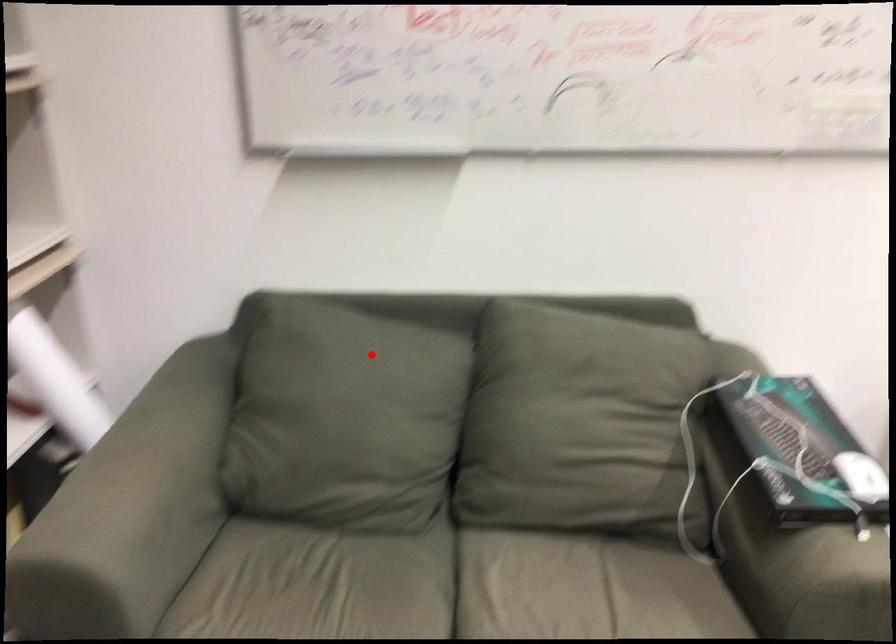
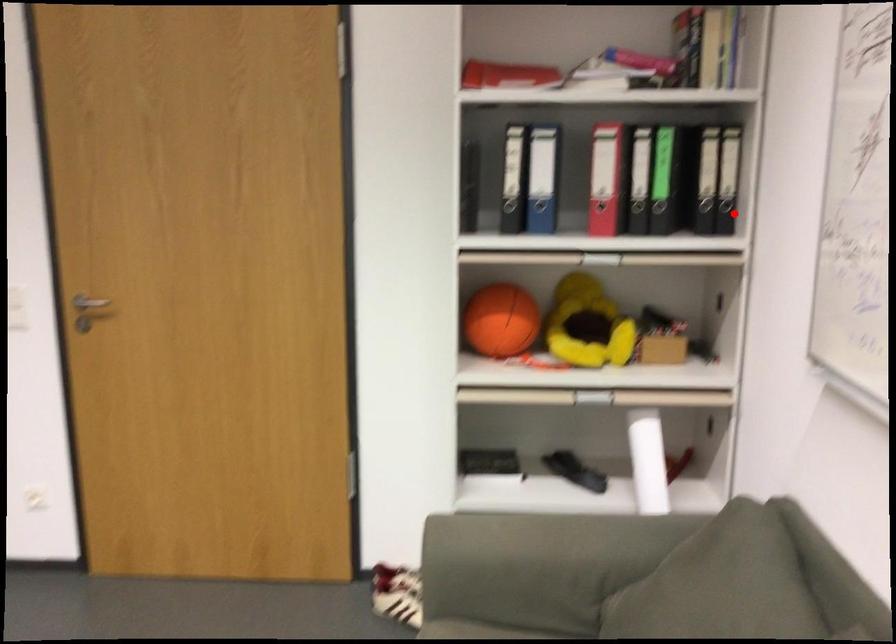
I am providing you with two images of the same scene from different viewpoints. A red point is marked on the first image and another point is marked on the second image. Is the marked point in image1 the same physical position as the marked point in image2?

No